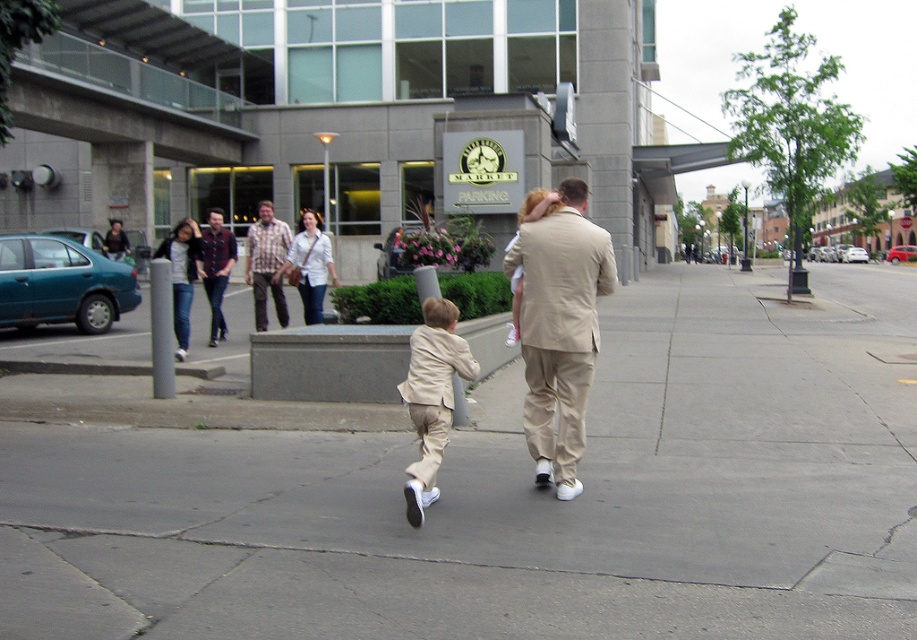
Is concrete sidewalk at center to the right of beige cotton suit at center from the viewer's perspective?

Yes, concrete sidewalk at center is to the right of beige cotton suit at center.

Is point (396, 563) less distant than point (438, 422)?

Yes, it is in front of point (438, 422).

Who is more distant from viewer, [57,445] or [418,342]?

The point [57,445] is behind.

I want to click on concrete sidewalk at center, so click(518, 496).

Is beige cotton suit at center thinner than light beige suit at center?

No, beige cotton suit at center is not thinner than light beige suit at center.

Is the position of beige cotton suit at center more distant than that of light beige suit at center?

No, it is in front of light beige suit at center.

Consider the image. Who is more forward, (438, 394) or (538, 189)?

Point (438, 394)

Find the location of a particular element. This screenshot has height=640, width=917. beige cotton suit at center is located at coordinates (431, 396).

Does concrete sidewalk at center have a larger size compared to maroon plaid shirt at center?

Indeed, concrete sidewalk at center has a larger size compared to maroon plaid shirt at center.

Does concrete sidewalk at center have a smaller size compared to maroon plaid shirt at center?

No, concrete sidewalk at center is not smaller than maroon plaid shirt at center.

What do you see at coordinates (518, 496) in the screenshot? Image resolution: width=917 pixels, height=640 pixels. I see `concrete sidewalk at center` at bounding box center [518, 496].

Find the location of a particular element. concrete sidewalk at center is located at coordinates (518, 496).